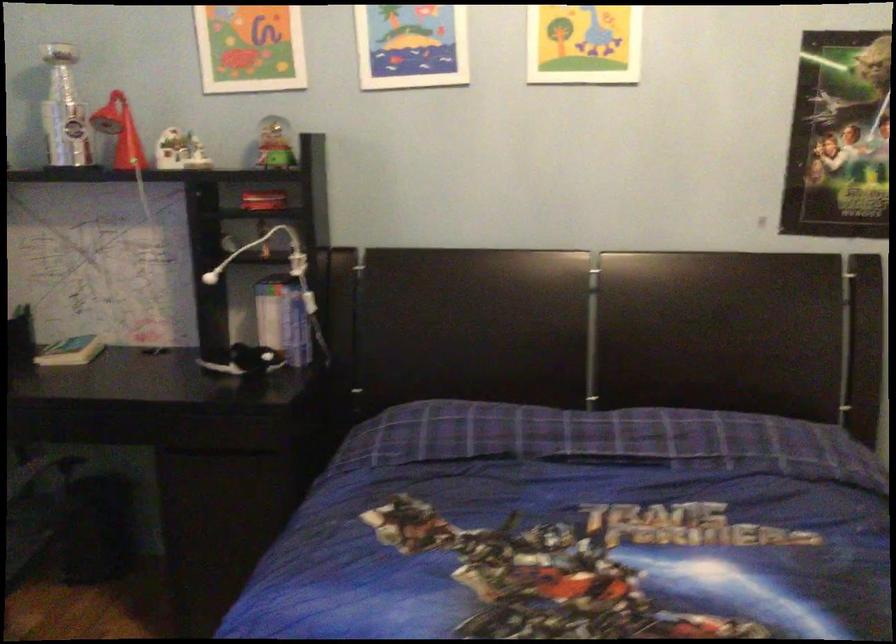
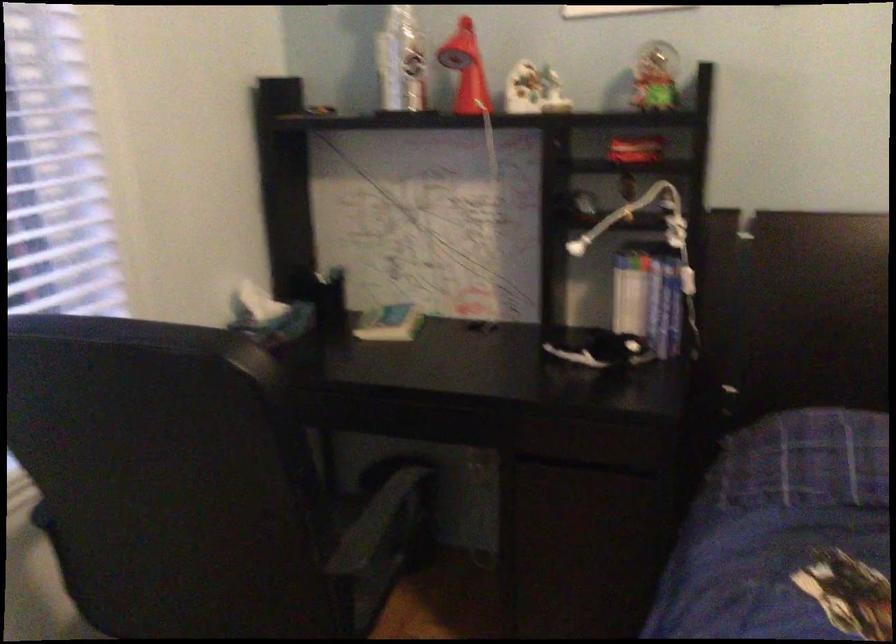
The point at (295, 323) is marked in the first image. Where is the corresponding point in the second image?

(664, 307)